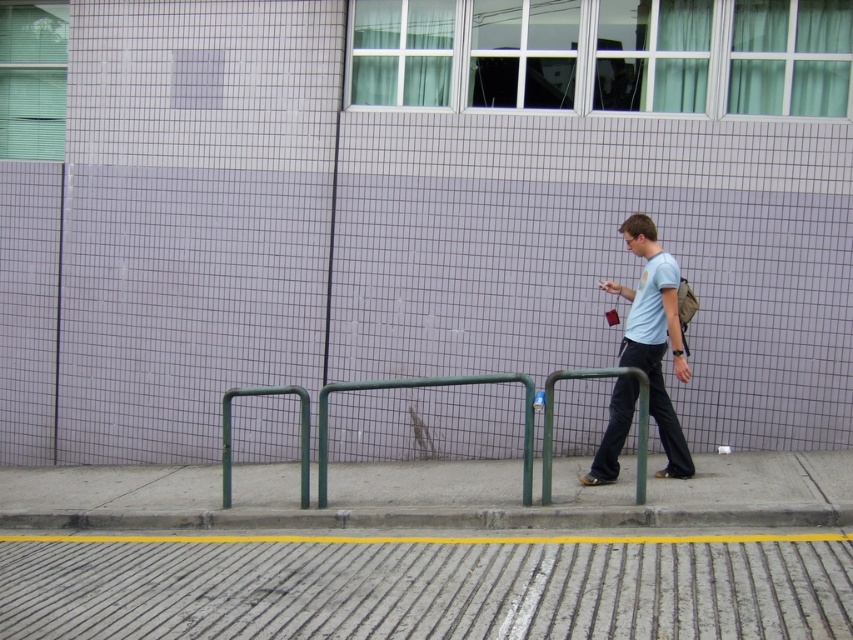
Question: Which point is closer to the camera taking this photo?

Choices:
 (A) (227, 465)
 (B) (190, 577)

Answer: (B)

Question: Is concrete textured pavement at lower center above green metal rail at center?

Choices:
 (A) no
 (B) yes

Answer: (A)

Question: Which point is farther to the camera?

Choices:
 (A) green metal rail at center
 (B) gray concrete curb at lower center
 (C) concrete textured pavement at lower center

Answer: (B)

Question: Is gray concrete curb at lower center closer to the viewer compared to green metal rail at center?

Choices:
 (A) yes
 (B) no

Answer: (B)

Question: Which point is farther to the camera?

Choices:
 (A) light blue t-shirt at center-right
 (B) green metal rail at center
 (C) gray concrete curb at lower center
 (D) concrete textured pavement at lower center

Answer: (A)

Question: Is light blue t-shirt at center-right bigger than green metal rail at center?

Choices:
 (A) yes
 (B) no

Answer: (B)